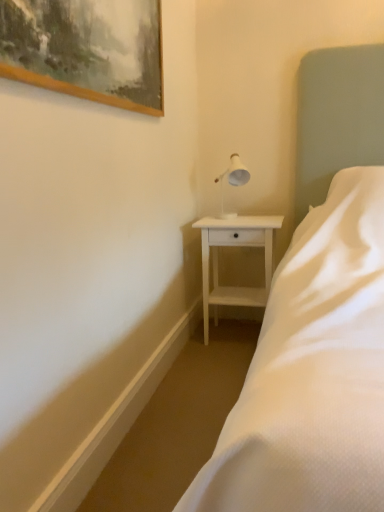
Question: From the image's perspective, is wooden picture frame at upper left over white satin bed at center?

Choices:
 (A) yes
 (B) no

Answer: (A)

Question: Is wooden picture frame at upper left in front of white satin bed at center?

Choices:
 (A) yes
 (B) no

Answer: (B)

Question: Considering the relative sizes of wooden picture frame at upper left and white satin bed at center in the image provided, is wooden picture frame at upper left thinner than white satin bed at center?

Choices:
 (A) no
 (B) yes

Answer: (B)

Question: Is wooden picture frame at upper left shorter than white satin bed at center?

Choices:
 (A) no
 (B) yes

Answer: (B)

Question: Considering the relative positions of wooden picture frame at upper left and white satin bed at center in the image provided, is wooden picture frame at upper left to the right of white satin bed at center from the viewer's perspective?

Choices:
 (A) no
 (B) yes

Answer: (A)

Question: Based on their sizes in the image, would you say wooden picture frame at upper left is bigger or smaller than white wood nightstand at center?

Choices:
 (A) small
 (B) big

Answer: (A)

Question: In terms of height, does wooden picture frame at upper left look taller or shorter compared to white wood nightstand at center?

Choices:
 (A) tall
 (B) short

Answer: (B)

Question: Relative to white wood nightstand at center, is wooden picture frame at upper left in front or behind?

Choices:
 (A) behind
 (B) front

Answer: (B)

Question: From the image's perspective, is wooden picture frame at upper left located above or below white wood nightstand at center?

Choices:
 (A) above
 (B) below

Answer: (A)

Question: From the image's perspective, relative to white satin bed at center, is white glossy table lamp at upper right above or below?

Choices:
 (A) above
 (B) below

Answer: (A)

Question: In terms of size, does white glossy table lamp at upper right appear bigger or smaller than white satin bed at center?

Choices:
 (A) big
 (B) small

Answer: (B)

Question: Considering the positions of white glossy table lamp at upper right and white satin bed at center in the image, is white glossy table lamp at upper right taller or shorter than white satin bed at center?

Choices:
 (A) short
 (B) tall

Answer: (A)

Question: Considering the positions of white glossy table lamp at upper right and white satin bed at center in the image, is white glossy table lamp at upper right wider or thinner than white satin bed at center?

Choices:
 (A) wide
 (B) thin

Answer: (B)

Question: Would you say white satin bed at center is inside or outside white wood nightstand at center?

Choices:
 (A) outside
 (B) inside

Answer: (A)

Question: Is point (278, 461) positioned closer to the camera than point (200, 221)?

Choices:
 (A) closer
 (B) farther

Answer: (A)